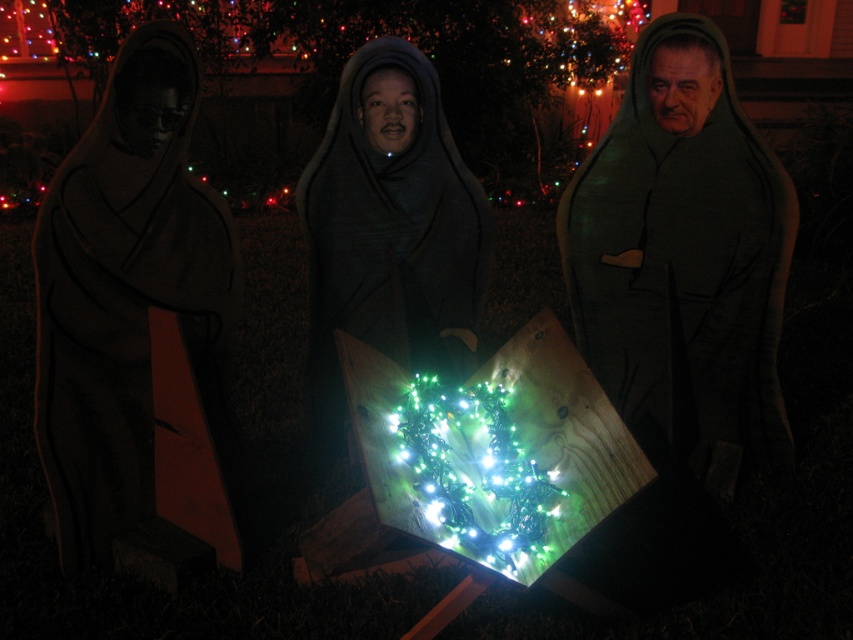
You are a delivery person who needs to place a small package between the dark matte robe at center and the matte black robe at center. Can you fit the package, which is 25 inches long, between them?

The dark matte robe at center is 26.61 inches away from the matte black robe at center. Since the package is 25 inches long, it can fit between them as the distance is slightly larger than the package length.

You are a visitor at the nativity display and want to take a photo of the black matte robe at left and the matte black robe at center. Which robe is positioned lower in the frame?

The black matte robe at left is positioned lower than the matte black robe at center, so it is the one that is lower in the frame.